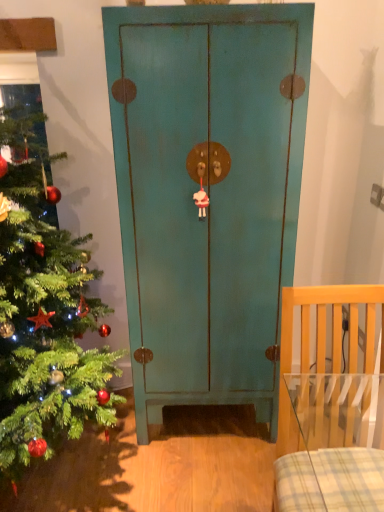
Question: From the image's perspective, is teal matte cabinet at center above or below light wood chair at right?

Choices:
 (A) above
 (B) below

Answer: (A)

Question: From a real-world perspective, is teal matte cabinet at center positioned above or below light wood chair at right?

Choices:
 (A) above
 (B) below

Answer: (A)

Question: Estimate the real-world distances between objects in this image. Which object is farther from the green matte christmas tree at left?

Choices:
 (A) teal matte cabinet at center
 (B) light wood chair at right

Answer: (B)

Question: Considering the real-world distances, which object is closest to the teal matte cabinet at center?

Choices:
 (A) light wood chair at right
 (B) green matte christmas tree at left

Answer: (B)